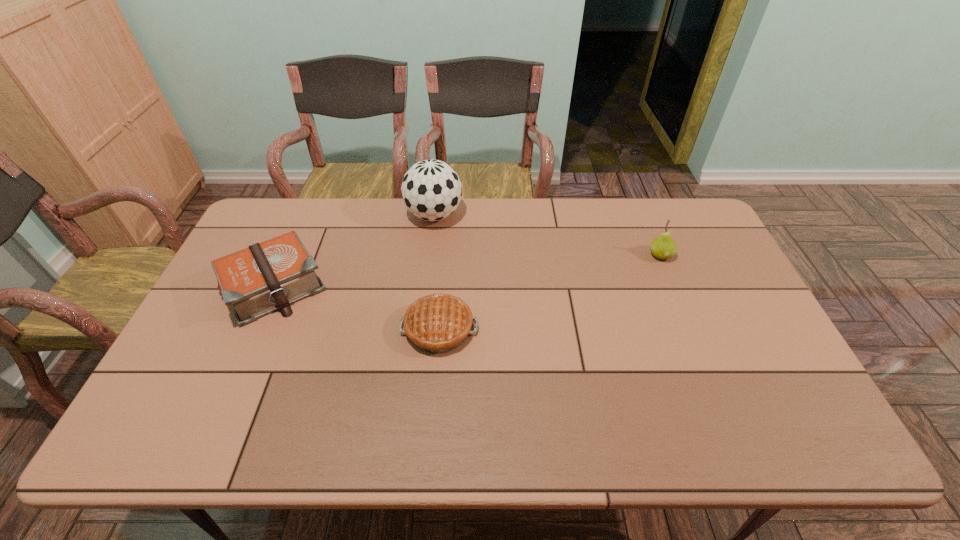
Identify the location of the farthest object. The width and height of the screenshot is (960, 540). point(431,190).

Locate an element on the screen. This screenshot has height=540, width=960. the tallest object is located at coordinates (431, 190).

The image size is (960, 540). Identify the location of pear. (663, 247).

You are a GUI agent. You are given a task and a screenshot of the screen. Output one action in this format:
    pyautogui.click(x=<x>, y=<y>)
    Task: Click on the rightmost object
    Image resolution: width=960 pixels, height=540 pixels.
    Given the screenshot: What is the action you would take?
    pyautogui.click(x=663, y=247)

The height and width of the screenshot is (540, 960). Identify the location of the leftmost object. (268, 276).

Find the location of a particular element. Bible is located at coordinates (268, 276).

The height and width of the screenshot is (540, 960). In order to click on the shortest object in this screenshot , I will do `click(438, 323)`.

Where is `free point located 0.120m on the left of the farthest object`? The height and width of the screenshot is (540, 960). free point located 0.120m on the left of the farthest object is located at coordinates (372, 215).

Locate an element on the screen. The height and width of the screenshot is (540, 960). vacant space situated on the front of the pear is located at coordinates (670, 277).

Identify the location of vacant area located on the right of the second shortest object. The width and height of the screenshot is (960, 540). (358, 287).